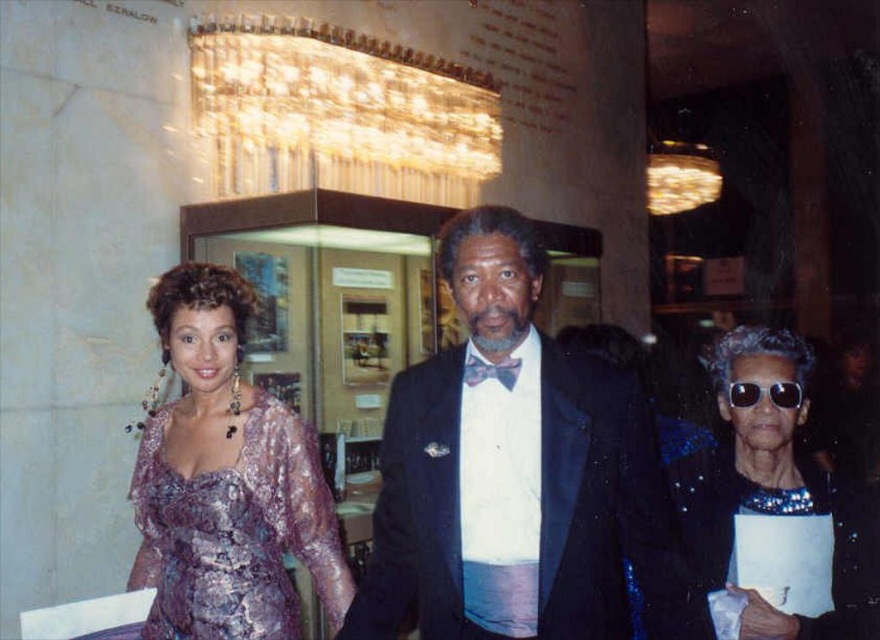
Which of these two, shiny purple dress at left or metallic purple dress at left, stands taller?

metallic purple dress at left

What do you see at coordinates (671, 516) in the screenshot? This screenshot has height=640, width=880. I see `shiny purple dress at left` at bounding box center [671, 516].

Locate an element on the screen. shiny purple dress at left is located at coordinates (671, 516).

Does shiny purple dress at left come in front of black reflective sunglasses at center?

Yes, shiny purple dress at left is closer to the viewer.

Between shiny purple dress at left and black reflective sunglasses at center, which one appears on the right side from the viewer's perspective?

black reflective sunglasses at center is more to the right.

Locate an element on the screen. shiny purple dress at left is located at coordinates pos(671,516).

Who is taller, shiny sequined jacket at lower right or black reflective sunglasses at center?

shiny sequined jacket at lower right

Is point (694, 545) in front of point (796, 404)?

No, (694, 545) is further to viewer.

Describe the element at coordinates (774, 513) in the screenshot. I see `shiny sequined jacket at lower right` at that location.

You are a GUI agent. You are given a task and a screenshot of the screen. Output one action in this format:
    pyautogui.click(x=<x>, y=<y>)
    Task: Click on the shiny sequined jacket at lower right
    The height and width of the screenshot is (640, 880).
    Given the screenshot: What is the action you would take?
    pyautogui.click(x=774, y=513)